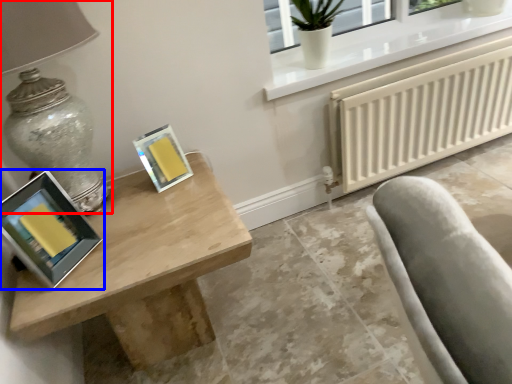
Question: Which point is closer to the camera, table lamp (highlighted by a red box) or picture frame (highlighted by a blue box)?

Choices:
 (A) table lamp
 (B) picture frame

Answer: (A)